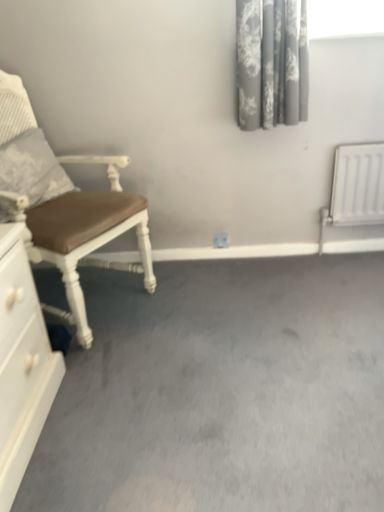
You are a GUI agent. You are given a task and a screenshot of the screen. Output one action in this format:
    pyautogui.click(x=<x>, y=<y>)
    Task: Click on the vacant space in front of brown leather chair at left
    This screenshot has width=384, height=512.
    Given the screenshot: What is the action you would take?
    tap(117, 383)